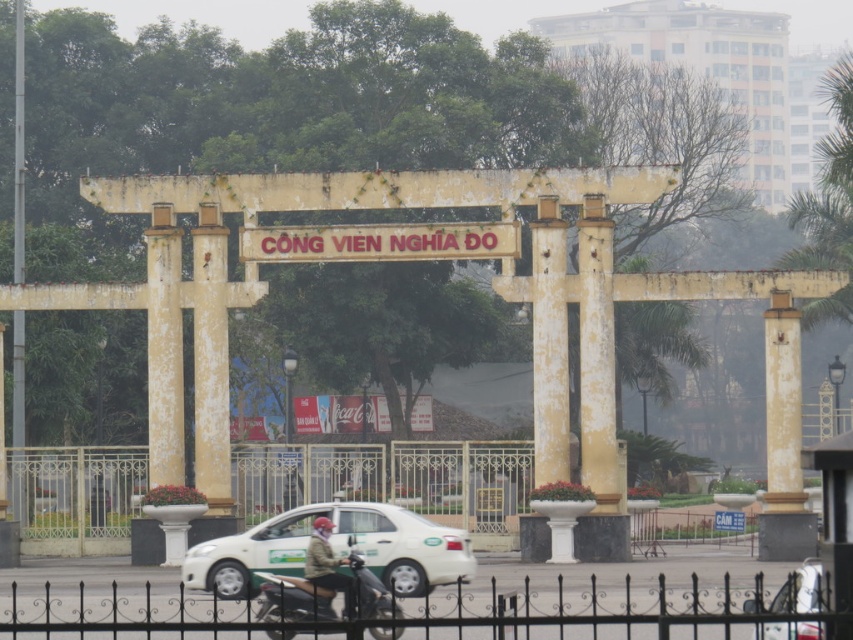
Can you confirm if black wrought iron fence at lower center is positioned above metallic silver motorcycle at center?

No, black wrought iron fence at lower center is not above metallic silver motorcycle at center.

Which is more to the left, black wrought iron fence at lower center or metallic silver motorcycle at center?

From the viewer's perspective, metallic silver motorcycle at center appears more on the left side.

Measure the distance between point (50, 608) and camera.

Point (50, 608) is 86.57 meters away from camera.

I want to click on black wrought iron fence at lower center, so click(x=608, y=611).

Does point (258, 628) lie behind point (347, 582)?

No, it is not.

Is black wrought iron fence at lower center bigger than green fabric jacket at center?

Yes.

What do you see at coordinates (608, 611) in the screenshot? I see `black wrought iron fence at lower center` at bounding box center [608, 611].

I want to click on black wrought iron fence at lower center, so click(x=608, y=611).

In the scene shown: Who is shorter, white matte taxi at center or green fabric jacket at center?

Standing shorter between the two is green fabric jacket at center.

Is point (341, 545) positioned before point (317, 561)?

No, (341, 545) is further to viewer.

Locate an element on the screen. white matte taxi at center is located at coordinates (334, 548).